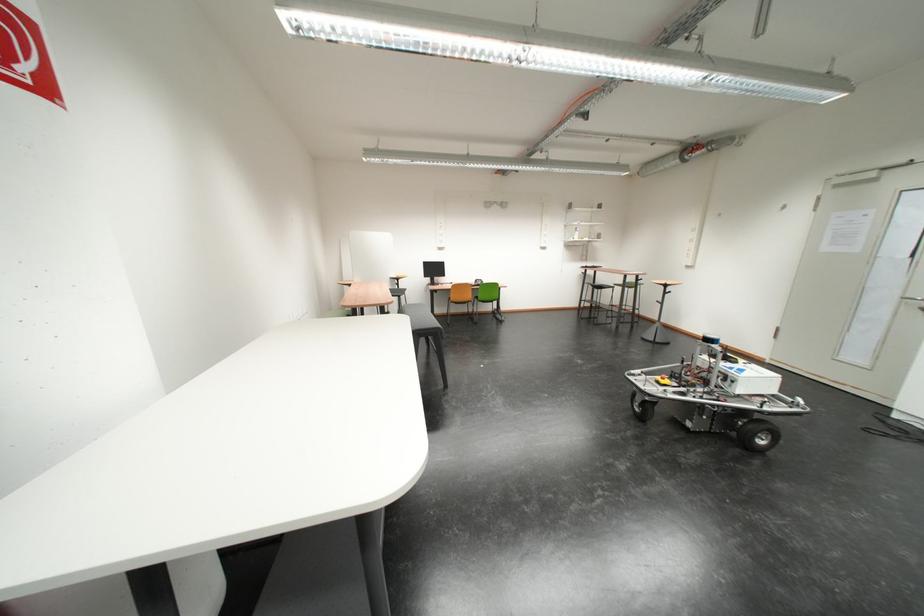
The width and height of the screenshot is (924, 616). Identify the location of dark gray stool surface. (419, 315).